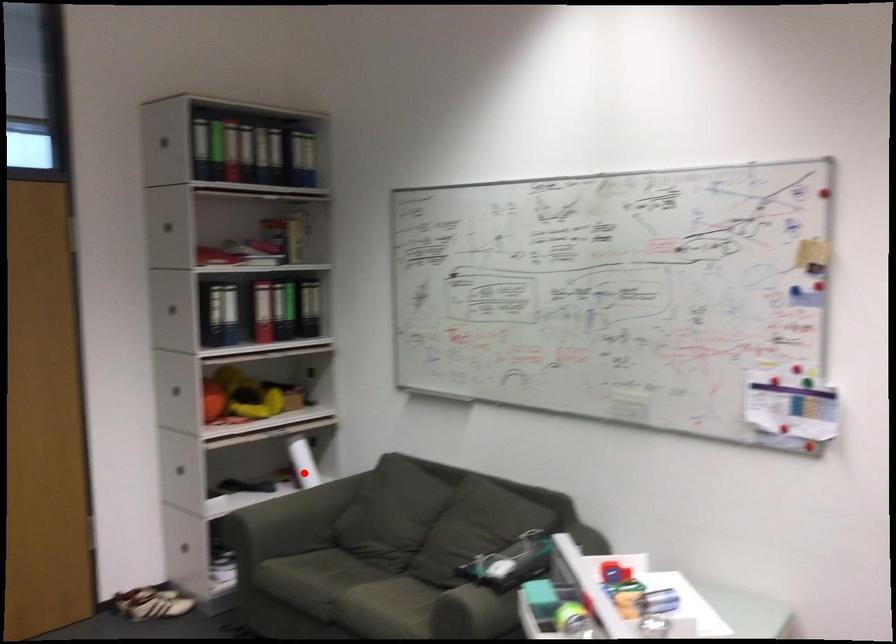
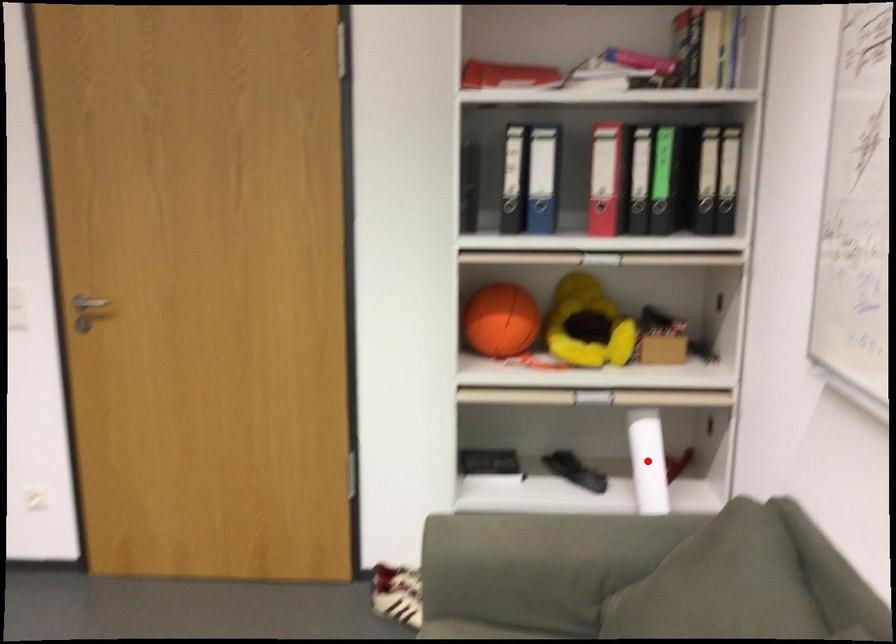
I am providing you with two images of the same scene from different viewpoints. A red point is marked on the first image and another point is marked on the second image. Is the red point in image1 aligned with the point shown in image2?

Yes